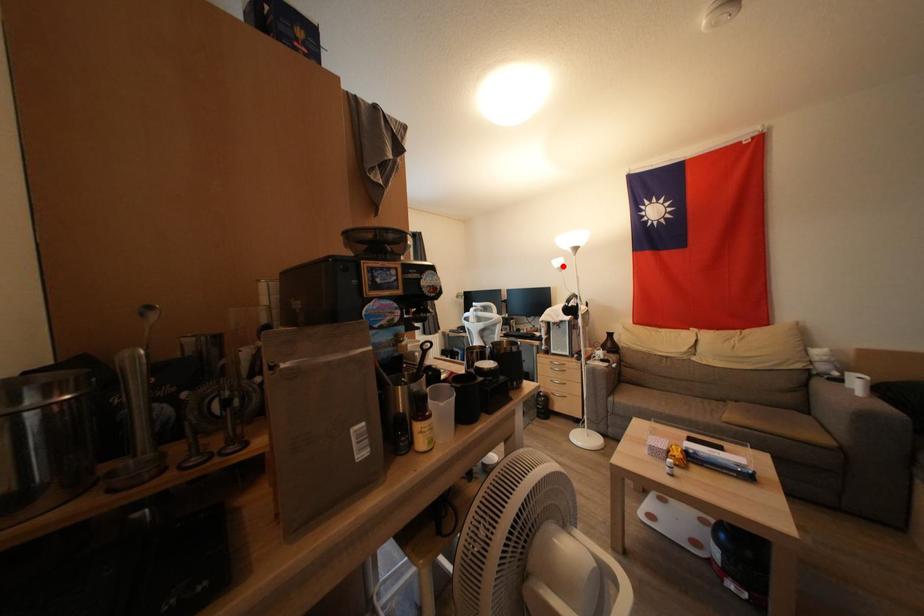
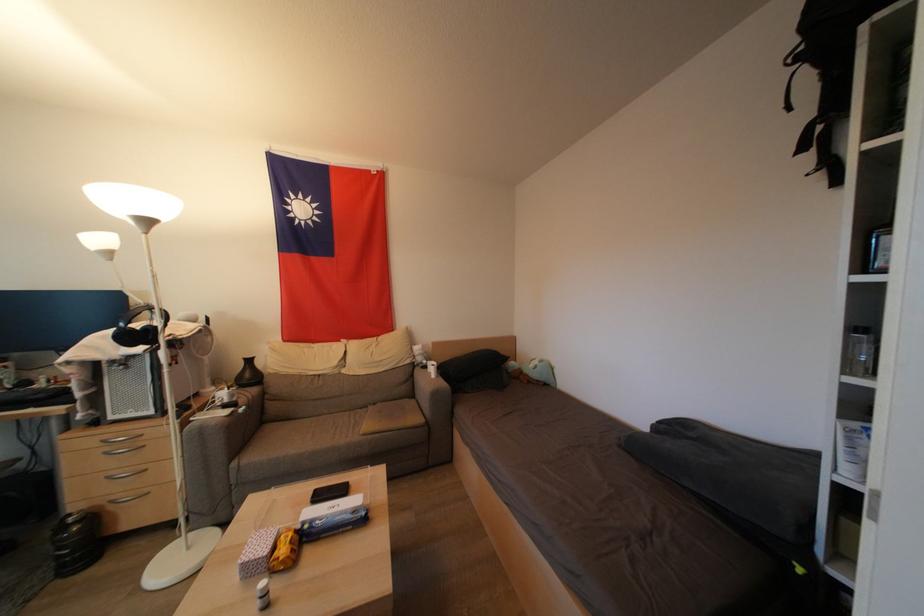
In the second image, find the point that corresponds to the highlighted location in the first image.

(104, 244)